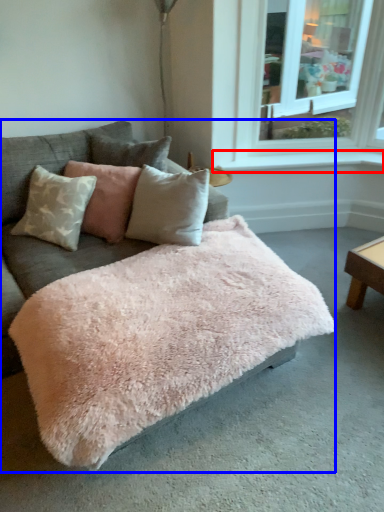
Question: Which object is closer to the camera taking this photo, window sill (highlighted by a red box) or studio couch (highlighted by a blue box)?

Choices:
 (A) window sill
 (B) studio couch

Answer: (B)